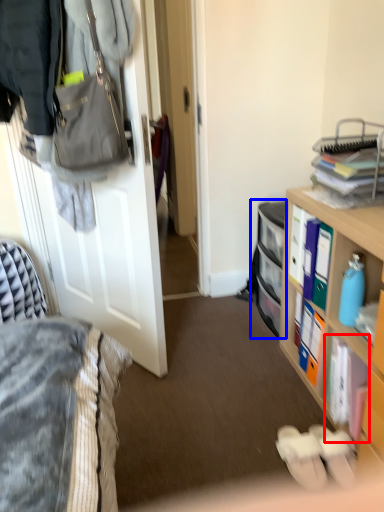
Question: Which object appears farthest to the camera in this image, book (highlighted by a red box) or cabinet (highlighted by a blue box)?

Choices:
 (A) book
 (B) cabinet

Answer: (B)